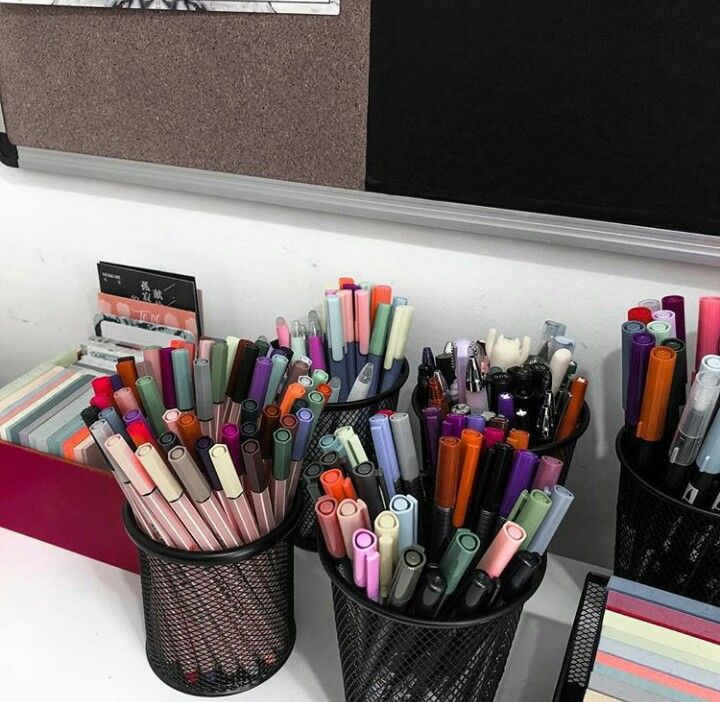
Locate an element on the screen. The height and width of the screenshot is (702, 720). desk is located at coordinates (93, 629).